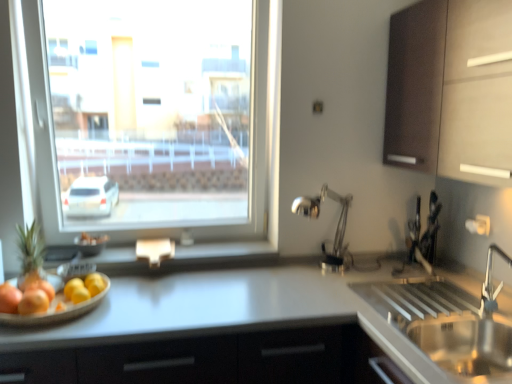
This screenshot has width=512, height=384. Describe the element at coordinates (90, 243) in the screenshot. I see `translucent glass bowl at left` at that location.

In order to face smooth wooden tray at lower left, which is the 1th fruit from left to right, should I rotate leftwards or rightwards?

Rotate left and turn 25.083 degrees.

Identify the location of white glossy countertop at center. The image size is (512, 384). (227, 333).

What is the approximate width of metallic silver window sill at center?

metallic silver window sill at center is 11.00 inches wide.

Describe the element at coordinates (156, 116) in the screenshot. I see `transparent glass window at upper left` at that location.

This screenshot has width=512, height=384. Identify the location of yellow matte lemon at lower left, the 2th fruit positioned from the left. (84, 288).

From the image's perspective, which is below, translucent glass bowl at left or transparent glass window at upper left?

translucent glass bowl at left is shown below in the image.

Could you tell me if translucent glass bowl at left is turned towards transparent glass window at upper left?

Yes, translucent glass bowl at left is turned towards transparent glass window at upper left.

Is translucent glass bowl at left far away from transparent glass window at upper left?

Absolutely, translucent glass bowl at left is distant from transparent glass window at upper left.

Considering the relative sizes of translucent glass bowl at left and transparent glass window at upper left in the image provided, is translucent glass bowl at left bigger than transparent glass window at upper left?

Incorrect, translucent glass bowl at left is not larger than transparent glass window at upper left.

Would you say silver metallic faucet at right is outside metallic silver window sill at center?

Absolutely, silver metallic faucet at right is external to metallic silver window sill at center.

Which point is more forward, (331, 254) or (127, 252)?

The point (127, 252) is closer.

From the picture: Is silver metallic faucet at right shorter than metallic silver window sill at center?

No, silver metallic faucet at right is not shorter than metallic silver window sill at center.

From a real-world perspective, which object stands above the other?

silver metallic faucet at right.

In the scene shown: Looking at their sizes, would you say green matte pineapple at left is wider or thinner than transparent glass window at upper left?

In the image, green matte pineapple at left appears to be more narrow than transparent glass window at upper left.

Can you see green matte pineapple at left touching transparent glass window at upper left?

No, green matte pineapple at left is not touching transparent glass window at upper left.

Between green matte pineapple at left and transparent glass window at upper left, which one has more height?

transparent glass window at upper left is taller.

This screenshot has height=384, width=512. What are the coordinates of `fruit that is the 2nd object directly below the silver metallic faucet at right (from a real-world perspective)` in the screenshot? It's located at point(7,283).

From the image's perspective, is smooth wooden tray at lower left, which is the 2th fruit in right-to-left order, beneath silver metallic faucet at right?

Yes, from the image's perspective, smooth wooden tray at lower left, which is the 2th fruit in right-to-left order, is below silver metallic faucet at right.

How many degrees apart are the facing directions of smooth wooden tray at lower left, which is the 2th fruit in right-to-left order, and silver metallic faucet at right?

1.76 degrees.

Does smooth wooden tray at lower left, which is the 1th fruit from left to right, have a greater height compared to silver metallic faucet at right?

No.

Is transparent glass window at upper left oriented away from metallic silver window sill at center?

No, transparent glass window at upper left is not facing away from metallic silver window sill at center.

Considering the relative sizes of transparent glass window at upper left and metallic silver window sill at center in the image provided, is transparent glass window at upper left taller than metallic silver window sill at center?

Correct, transparent glass window at upper left is much taller as metallic silver window sill at center.

Which object is further away from the camera taking this photo, transparent glass window at upper left or metallic silver window sill at center?

Positioned behind is metallic silver window sill at center.

From a real-world perspective, is transparent glass window at upper left below metallic silver window sill at center?

No, from a real-world perspective, transparent glass window at upper left is not beneath metallic silver window sill at center.

Which is behind, point (444, 8) or point (161, 93)?

Point (161, 93)

Is dark wood cabinet at upper right far away from transparent glass window at upper left?

Yes, dark wood cabinet at upper right is far from transparent glass window at upper left.

Considering the sizes of dark wood cabinet at upper right and transparent glass window at upper left in the image, is dark wood cabinet at upper right bigger or smaller than transparent glass window at upper left?

dark wood cabinet at upper right is smaller than transparent glass window at upper left.

Is dark wood cabinet at upper right further to the viewer compared to transparent glass window at upper left?

No, the depth of dark wood cabinet at upper right is less than that of transparent glass window at upper left.

How many degrees apart are the facing directions of translucent glass bowl at left and white glossy countertop at center?

They differ by 4.4 degrees in their facing directions.

From a real-world perspective, who is located higher, translucent glass bowl at left or white glossy countertop at center?

translucent glass bowl at left, from a real-world perspective.

Based on the photo, is translucent glass bowl at left closer to the viewer compared to white glossy countertop at center?

No, the depth of translucent glass bowl at left is greater than that of white glossy countertop at center.

From the picture: Measure the distance from translucent glass bowl at left to white glossy countertop at center.

They are 87.35 centimeters apart.

You are a GUI agent. You are given a task and a screenshot of the screen. Output one action in this format:
    pyautogui.click(x=<x>, y=<y>)
    Task: Click on the glass bowl on the left of transparent glass window at upper left
    This screenshot has width=512, height=384.
    Given the screenshot: What is the action you would take?
    pyautogui.click(x=90, y=243)

Where is `faucet that is above the metallic silver window sill at center (from the image's perspective)`? faucet that is above the metallic silver window sill at center (from the image's perspective) is located at coordinates (336, 228).

When comparing their distances from white glossy countertop at center, does green matte pineapple at left or silver metallic faucet at right seem further?

green matte pineapple at left is further to white glossy countertop at center.

Considering their positions, is metallic silver window sill at center positioned further to silver metallic faucet at right than dark wood cabinet at upper right?

The object further to silver metallic faucet at right is dark wood cabinet at upper right.

Based on their spatial positions, is dark wood cabinet at upper right or white glossy countertop at center further from transparent glass window at upper left?

dark wood cabinet at upper right is further to transparent glass window at upper left.

Considering their positions, is translucent glass bowl at left positioned further to white glossy countertop at center than green matte pineapple at left?

Among the two, translucent glass bowl at left is located further to white glossy countertop at center.

Based on their spatial positions, is smooth wooden tray at lower left, which is the 1th fruit from left to right, or green matte pineapple at left closer to translucent glass bowl at left?

The object closer to translucent glass bowl at left is green matte pineapple at left.

Consider the image. From the image, which object appears to be farther from silver metallic faucet at right, yellow matte lemon at lower left, the 1th fruit positioned from the right, or smooth wooden tray at lower left, which is the 1th fruit from left to right?

smooth wooden tray at lower left, which is the 1th fruit from left to right, is further to silver metallic faucet at right.

Estimate the real-world distances between objects in this image. Which object is closer to yellow matte lemon at lower left, the 1th fruit positioned from the right, metallic silver window sill at center or white glossy countertop at center?

Based on the image, metallic silver window sill at center appears to be nearer to yellow matte lemon at lower left, the 1th fruit positioned from the right.

Estimate the real-world distances between objects in this image. Which object is closer to smooth wooden tray at lower left, which is the 1th fruit from left to right, silver metallic faucet at right or dark wood cabinet at upper right?

silver metallic faucet at right is closer to smooth wooden tray at lower left, which is the 1th fruit from left to right.

Locate an element on the screen. This screenshot has height=384, width=512. window sill between transparent glass window at upper left and silver metallic faucet at right from left to right is located at coordinates (188, 257).

At what (x,y) coordinates should I click in order to perform the action: click on countertop situated between transparent glass window at upper left and dark wood cabinet at upper right from left to right. Please return your answer as a coordinate pair (x, y). This screenshot has height=384, width=512. Looking at the image, I should click on (227, 333).

Find the location of a particular element. faucet between transparent glass window at upper left and satin nickel sink at lower right is located at coordinates (336, 228).

You are a GUI agent. You are given a task and a screenshot of the screen. Output one action in this format:
    pyautogui.click(x=<x>, y=<y>)
    Task: Click on the window sill between yellow matte lemon at lower left, the 2th fruit positioned from the left, and translucent glass bowl at left, along the z-axis
    
    Given the screenshot: What is the action you would take?
    pyautogui.click(x=188, y=257)